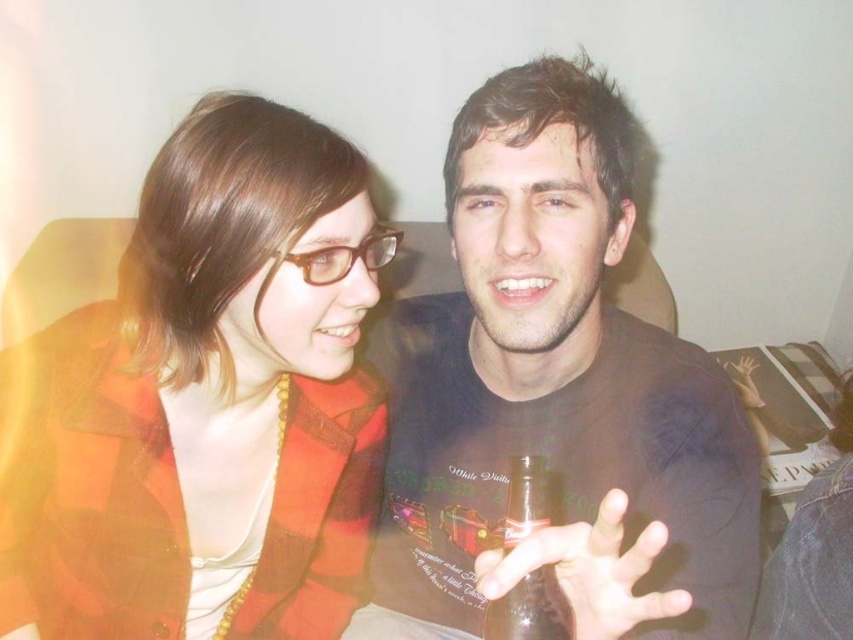
Question: Does plaid fabric jacket at left have a greater width compared to matte black t-shirt at center?

Choices:
 (A) no
 (B) yes

Answer: (A)

Question: Which point appears farthest from the camera in this image?

Choices:
 (A) (274, 221)
 (B) (567, 621)
 (C) (555, 412)

Answer: (C)

Question: Is plaid fabric jacket at left above matte black t-shirt at center?

Choices:
 (A) no
 (B) yes

Answer: (B)

Question: Which of the following is the farthest from the observer?

Choices:
 (A) (74, 461)
 (B) (498, 621)

Answer: (A)

Question: Among these points, which one is nearest to the camera?

Choices:
 (A) (520, 620)
 (B) (321, 200)
 (C) (543, 328)

Answer: (A)

Question: From the image, what is the correct spatial relationship of plaid fabric jacket at left in relation to matte black t-shirt at center?

Choices:
 (A) below
 (B) above

Answer: (B)